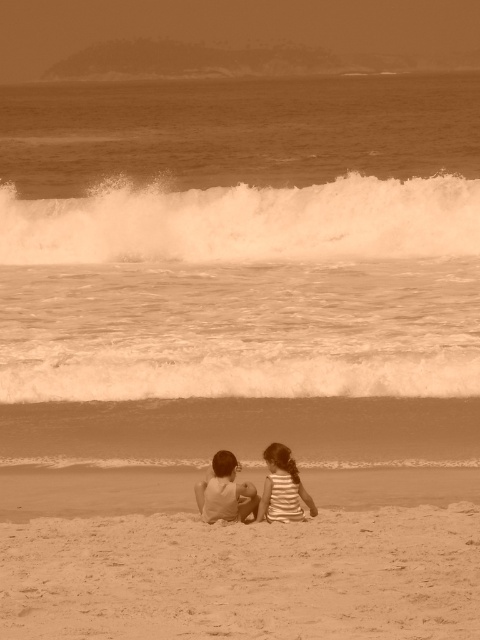
Does point (115, 516) come farther from viewer compared to point (295, 467)?

Yes, point (115, 516) is behind point (295, 467).

Between fine-grained sand at lower center and striped fabric child at lower center, which one is positioned lower?

fine-grained sand at lower center

Is point (304, 557) behind point (267, 512)?

No, it is in front of (267, 512).

At what (x,y) coordinates should I click in order to perform the action: click on fine-grained sand at lower center. Please return your answer as a coordinate pair (x, y). This screenshot has width=480, height=640. Looking at the image, I should click on (243, 577).

Consider the image. Is fine-grained sand at lower center bigger than white foamy wave at upper center?

No.

Which is in front, point (131, 531) or point (444, 214)?

Point (131, 531)

Is point (122, 524) closer to viewer compared to point (247, 252)?

That is True.

Identify the location of fine-grained sand at lower center. (243, 577).

Describe the element at coordinates (225, 492) in the screenshot. I see `striped fabric child at center` at that location.

Can you confirm if striped fabric child at center is taller than striped fabric child at lower center?

In fact, striped fabric child at center may be shorter than striped fabric child at lower center.

Where is `striped fabric child at center`? This screenshot has height=640, width=480. striped fabric child at center is located at coordinates (225, 492).

Find the location of a particular element. striped fabric child at center is located at coordinates (225, 492).